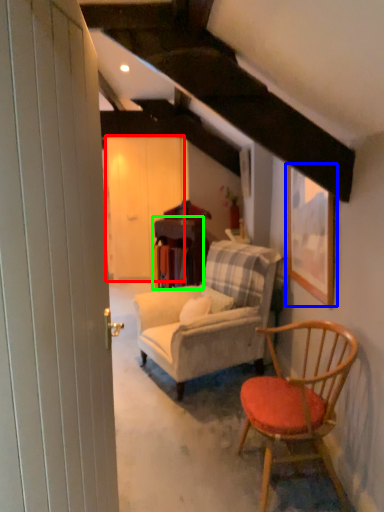
Question: Based on their relative distances, which object is nearer to barn door (highlighted by a red box)? Choose from picture frame (highlighted by a blue box) and table (highlighted by a green box).

Choices:
 (A) picture frame
 (B) table

Answer: (B)